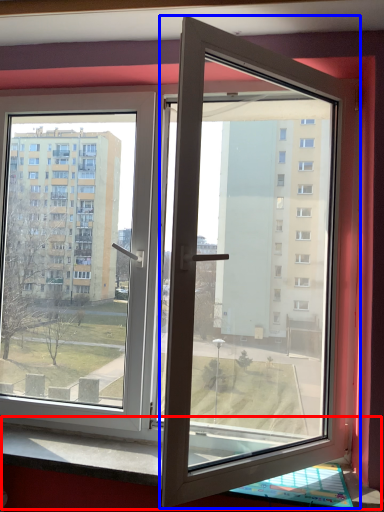
Question: Among these objects, which one is farthest to the camera, window sill (highlighted by a red box) or door (highlighted by a blue box)?

Choices:
 (A) window sill
 (B) door

Answer: (A)